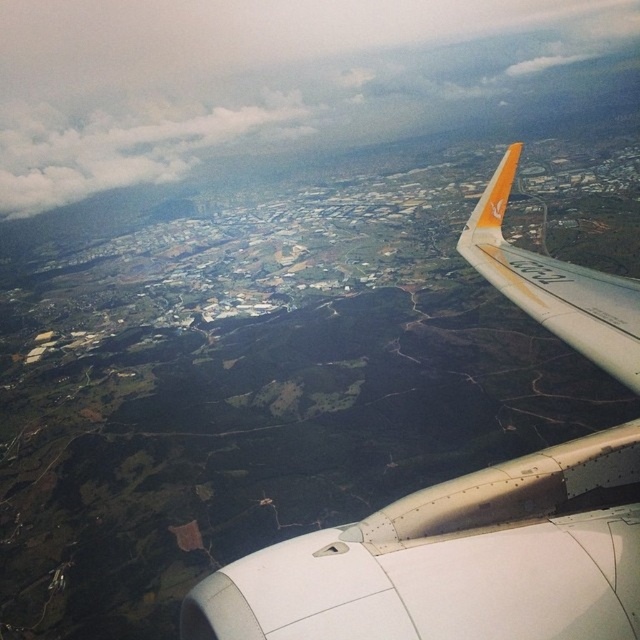
You are a flight attendant on the Vueling airplane. You notice the white matte airplane wing at upper right and the orange matte winglet at upper right. Which object is larger in size?

The white matte airplane wing at upper right is smaller than the orange matte winglet at upper right, so the orange matte winglet at upper right is larger.

You are a flight attendant on the Vueling airplane. You notice the white matte airplane wing at upper right and the orange matte winglet at upper right. Which object is positioned lower from your viewpoint?

The white matte airplane wing at upper right is located below the orange matte winglet at upper right, so it is positioned lower from your viewpoint.

You are a passenger sitting in the airplane and looking out the window. You notice the white fluffy cloud at upper left and the orange matte winglet at upper right. Which object is closer to you from your viewing position?

The white fluffy cloud at upper left is closer to you because the orange matte winglet at upper right is behind it.